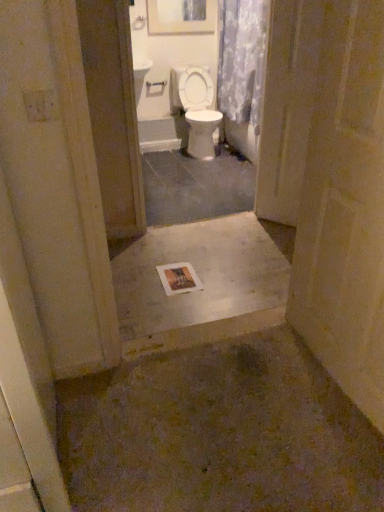
Question: In the image, is smooth beige door at lower right on the left side or the right side of floral fabric shower curtain at upper center?

Choices:
 (A) left
 (B) right

Answer: (B)

Question: Does point (x=352, y=293) appear closer or farther from the camera than point (x=243, y=11)?

Choices:
 (A) farther
 (B) closer

Answer: (B)

Question: Which object is positioned farthest from the clear plastic screen door at center?

Choices:
 (A) smooth beige door at lower right
 (B) white glossy toilet at center
 (C) wooden framed artwork at upper center
 (D) smooth concrete slab at center
 (E) floral fabric shower curtain at upper center

Answer: (C)

Question: Which object is the closest to the white glossy toilet at center?

Choices:
 (A) floral fabric shower curtain at upper center
 (B) wooden framed artwork at upper center
 (C) smooth concrete slab at center
 (D) clear plastic screen door at center
 (E) smooth beige door at lower right

Answer: (A)